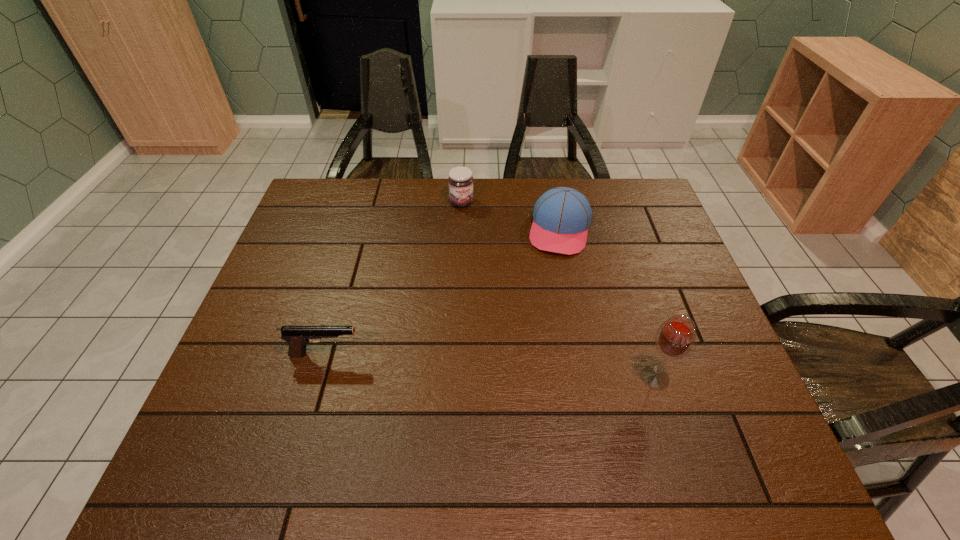
Locate an element on the screen. The width and height of the screenshot is (960, 540). free space at the far edge is located at coordinates (378, 179).

I want to click on free space at the near edge of the desktop, so click(x=628, y=401).

In the image, there is a desktop. Where is `vacant space at the left edge`? vacant space at the left edge is located at coordinates (229, 370).

The height and width of the screenshot is (540, 960). Identify the location of free region at the right edge of the desktop. (656, 312).

Where is `free spot at the far left corner of the desktop`? This screenshot has height=540, width=960. free spot at the far left corner of the desktop is located at coordinates (330, 220).

Locate an element on the screen. The height and width of the screenshot is (540, 960). free spot at the near left corner of the desktop is located at coordinates (251, 397).

This screenshot has width=960, height=540. Identify the location of free space at the near right corner of the desktop. (737, 424).

Identify the location of free space between the third object from right to left and the wineglass. (559, 290).

Identify the location of free space between the third object from right to left and the baseball cap. The height and width of the screenshot is (540, 960). (x=511, y=216).

Identify the location of vacant area that lies between the third object from left to right and the rightmost object. (608, 303).